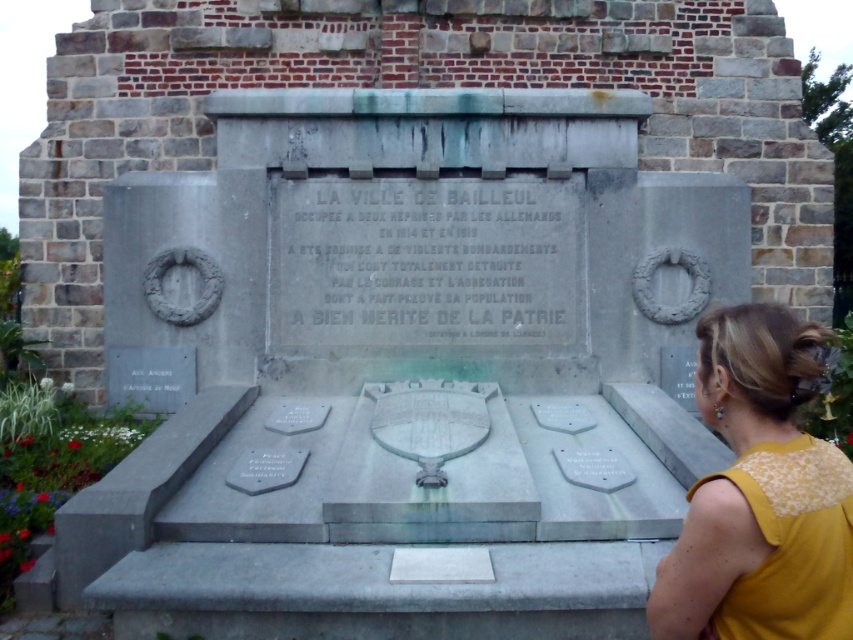
What is the location of the point with coordinates (407,368) in the image?

The point with coordinates (407,368) is located on the polished stone plaque at center.

You are a tour guide explaining the monument to visitors. You point out the polished stone plaque at center and the yellow fabric at right. Which object is located to the right of the other?

The polished stone plaque at center is positioned on the left side of yellow fabric at right, meaning the yellow fabric at right is to the right of the polished stone plaque at center.

You are standing in front of the monument and want to touch both points mentioned. Which point should you reach for first, the one at point [462,412] or the one at point [810,598]?

You should reach for the point at point [462,412] first because it is closer to you than the point at point [810,598].